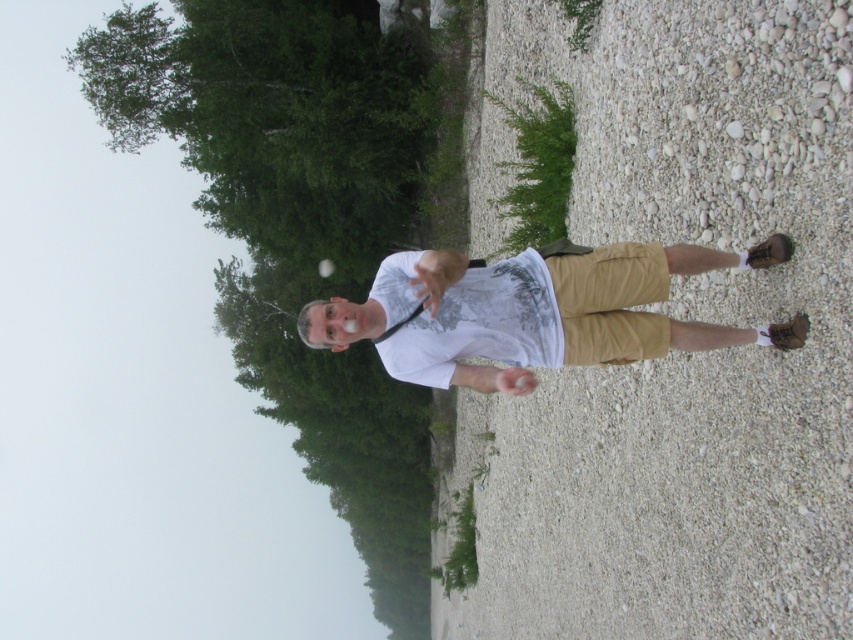
Consider the image. You are standing on the white gravel at center and looking down at the white matte shirt at center. Which object is higher in elevation?

The white gravel at center has a greater height compared to the white matte shirt at center, so the white gravel at center is higher.

You are standing in the image and want to place a small toy on the ground near the person. Since the white gravel at center and white matte shirt at center are both in the center, which surface should you choose to place the toy so it is on the ground?

The white gravel at center is located below the white matte shirt at center, so you should place the toy on the white gravel at center to ensure it is on the ground.